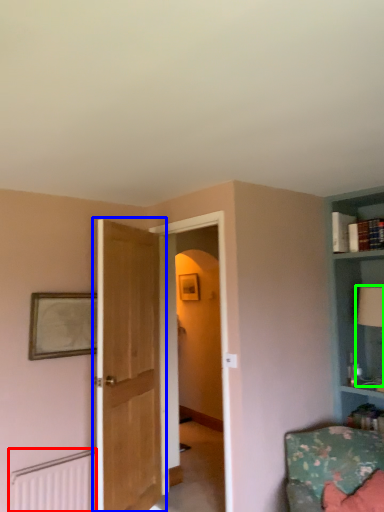
Question: Considering the real-world distances, which object is farthest from radiator (highlighted by a red box)? door (highlighted by a blue box) or table lamp (highlighted by a green box)?

Choices:
 (A) door
 (B) table lamp

Answer: (B)